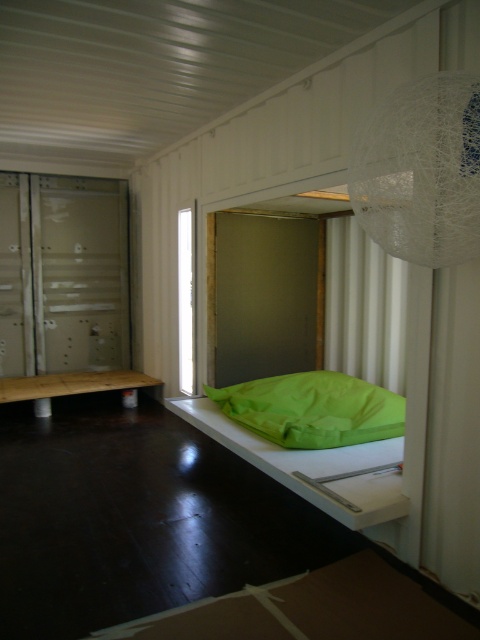
You are organizing a small event in the container and need to place a green fabric bed at center and a green fabric pillow at lower center. According to the scene description, which object is located to the left of the other?

The green fabric bed at center is positioned on the left side of green fabric pillow at lower center.

You are standing inside the container and looking at two points marked in the image. Which point is nearer to you, point (238, 452) or point (253, 429)?

Point (238, 452) is closer to the viewer than point (253, 429).

You are standing at the entrance of the container and want to place a new shelf. The shelf must be placed to the left of the green fabric bed at center. Where should you position the shelf?

The green fabric bed at center is located at point (x=313, y=467), so you should position the shelf to the left of this coordinate.